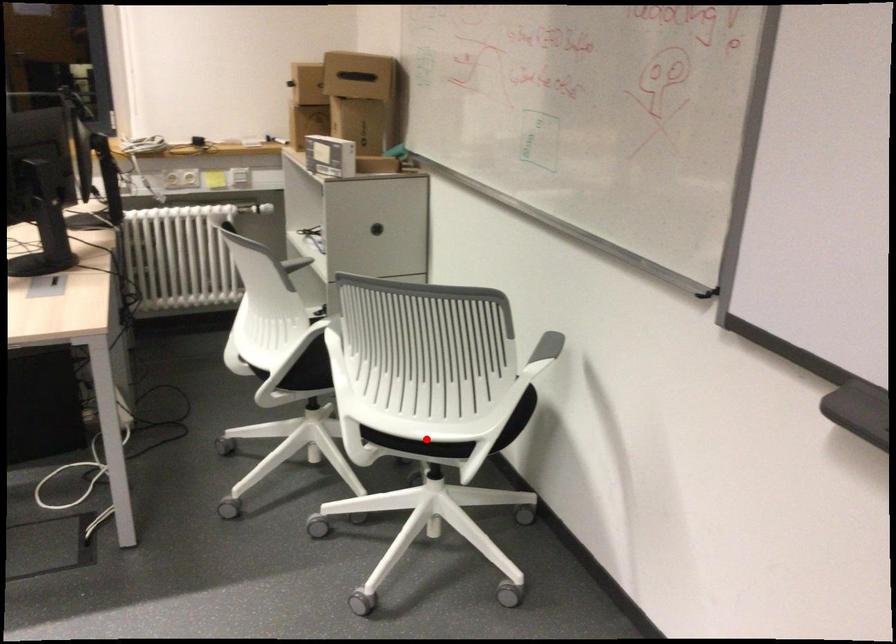
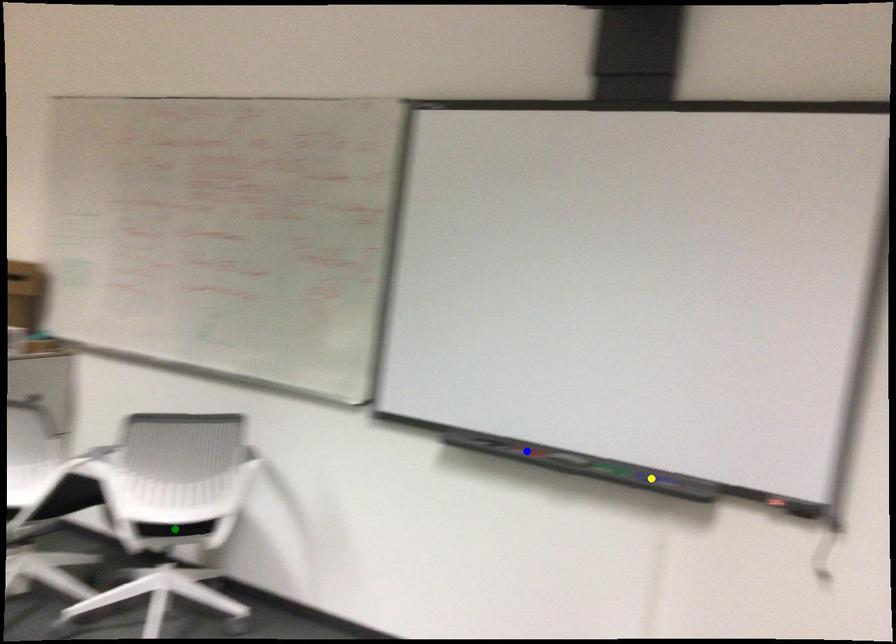
Question: I am providing you with two images of the same scene from different viewpoints. A red point is marked on the first image. You are given multiple points on the second image. Which mark in image 2 goes with the point in image 1?

Choices:
 (A) yellow point
 (B) blue point
 (C) green point

Answer: (C)